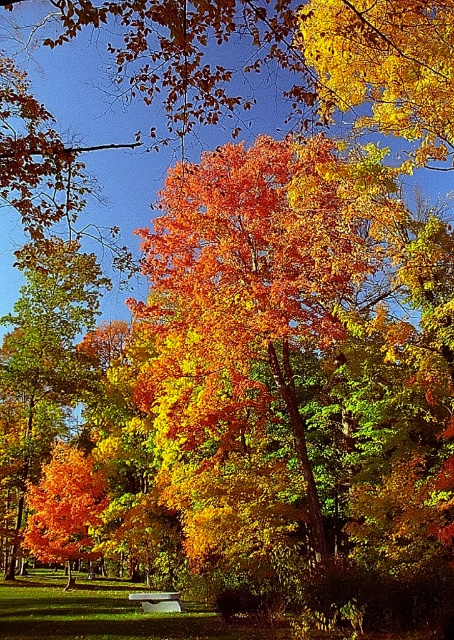
You are planning to place a decorative plaque on the white stone bench at center. The plaque is 1.2 meters wide. Can the plaque fit on the bench without overlapping the edges? Please consider the size of the bench compared to the shiny orange leaves at left.

The shiny orange leaves at left are wider than the white stone bench at center. Since the plaque is 1.2 meters wide and the bench is narrower than the leaves, the plaque may not fit without overlapping the edges unless the bench is sufficiently wide. However, without specific measurements of the bench itself, we cannot definitively confirm. The question mentions comparing the bench to the leaves, but the leaves being wider doesn

You are planning to place a decorative wreath that is 1.2 meters wide on the white stone bench at center. Based on the scene, will the shiny orange leaves at center interfere with placing the wreath on the bench?

The shiny orange leaves at center are wider than the white stone bench at center. Since the wreath is 1.2 meters wide, it may not fit properly on the bench due to the leaves being wider, potentially overlapping the bench area.